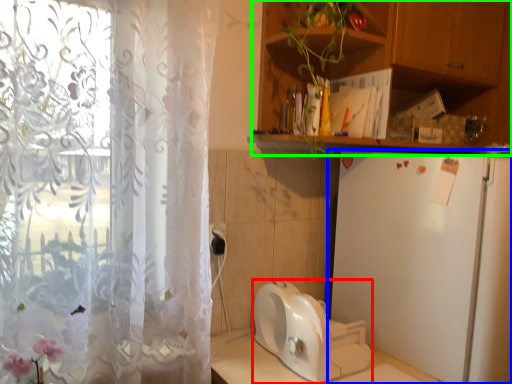
Question: Based on their relative distances, which object is nearer to appliance (highlighted by a red box)? Choose from refrigerator (highlighted by a blue box) and cabinetry (highlighted by a green box).

Choices:
 (A) refrigerator
 (B) cabinetry

Answer: (A)